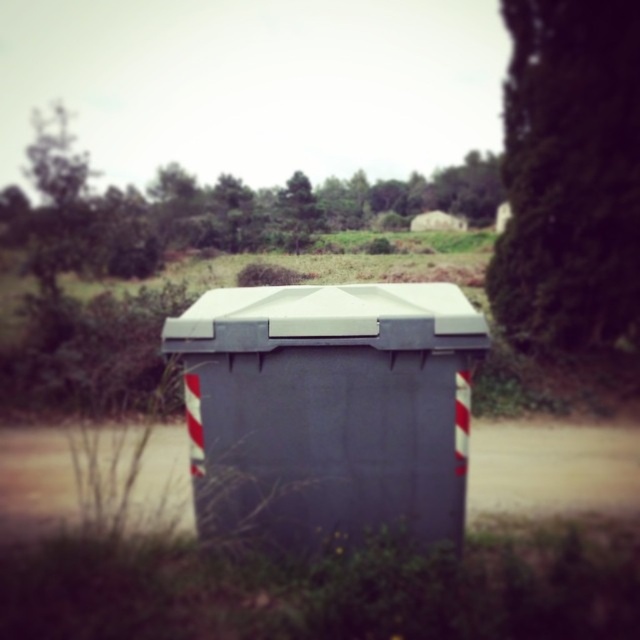
Is green leafy tree at upper right shorter than green leafy tree at upper center?

Indeed, green leafy tree at upper right has a lesser height compared to green leafy tree at upper center.

Does green leafy tree at upper right have a lesser width compared to green leafy tree at upper center?

Yes, green leafy tree at upper right is thinner than green leafy tree at upper center.

I want to click on green leafy tree at upper right, so click(x=570, y=177).

Locate an element on the screen. gray matte container at center is located at coordinates [x=328, y=410].

Is gray matte container at center to the right of green leafy tree at upper right from the viewer's perspective?

No, gray matte container at center is not to the right of green leafy tree at upper right.

At what (x,y) coordinates should I click in order to perform the action: click on gray matte container at center. Please return your answer as a coordinate pair (x, y). This screenshot has height=640, width=640. Looking at the image, I should click on (328, 410).

Who is positioned more to the left, gray matte container at center or green leafy tree at upper center?

green leafy tree at upper center is more to the left.

Is point (451, 440) farther from camera compared to point (70, 198)?

That is False.

Image resolution: width=640 pixels, height=640 pixels. What are the coordinates of `gray matte container at center` in the screenshot? It's located at (328, 410).